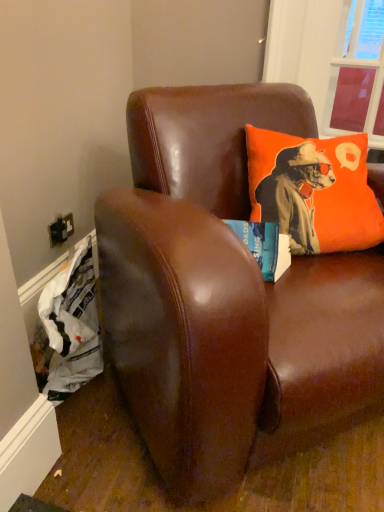
What do you see at coordinates (314, 191) in the screenshot? I see `orange fabric pillow at upper right` at bounding box center [314, 191].

Measure the distance between point (291, 233) and camera.

The depth of point (291, 233) is 3.80 feet.

The image size is (384, 512). I want to click on orange fabric pillow at upper right, so click(x=314, y=191).

Locate an element on the screen. pillow that is below the transparent plastic window screen at upper right (from the image's perspective) is located at coordinates (314, 191).

Considering the positions of points (362, 18) and (320, 149), is point (362, 18) farther from camera compared to point (320, 149)?

Yes.

Which object is more forward, transparent plastic window screen at upper right or orange fabric pillow at upper right?

orange fabric pillow at upper right is closer to the camera.

How far apart are transparent plastic window screen at upper right and orange fabric pillow at upper right?

transparent plastic window screen at upper right and orange fabric pillow at upper right are 1.41 meters apart from each other.

This screenshot has width=384, height=512. What are the coordinates of `studio couch below the orange fabric pillow at upper right (from the image's perspective)` in the screenshot? It's located at (226, 298).

Can you confirm if orange fabric pillow at upper right is thinner than brown leather couch at upper center?

Correct, the width of orange fabric pillow at upper right is less than that of brown leather couch at upper center.

At what (x,y) coordinates should I click in order to perform the action: click on pillow beneath the transparent plastic window screen at upper right (from a real-world perspective). Please return your answer as a coordinate pair (x, y). The width and height of the screenshot is (384, 512). Looking at the image, I should click on (314, 191).

From the picture: From the image's perspective, is orange fabric pillow at upper right beneath transparent plastic window screen at upper right?

Yes.

Which is less distant, (371, 191) or (352, 117)?

The point (371, 191) is closer to the camera.

Is orange fabric pillow at upper right next to transparent plastic window screen at upper right and touching it?

No, orange fabric pillow at upper right is not making contact with transparent plastic window screen at upper right.

Is brown leather couch at upper center oriented towards transparent plastic window screen at upper right?

No, brown leather couch at upper center is not facing towards transparent plastic window screen at upper right.

Who is shorter, brown leather couch at upper center or transparent plastic window screen at upper right?

Standing shorter between the two is transparent plastic window screen at upper right.

Can you confirm if brown leather couch at upper center is positioned to the right of transparent plastic window screen at upper right?

No, brown leather couch at upper center is not to the right of transparent plastic window screen at upper right.

Considering the points (219, 188) and (359, 85), which point is in front, point (219, 188) or point (359, 85)?

Point (219, 188)

From a real-world perspective, which object stands above the other?

transparent plastic window screen at upper right is physically above.

Looking at this image, how many degrees apart are the facing directions of transparent plastic window screen at upper right and brown leather couch at upper center?

There is a 44.5-degree angle between the facing directions of transparent plastic window screen at upper right and brown leather couch at upper center.

Can you confirm if transparent plastic window screen at upper right is thinner than brown leather couch at upper center?

Correct, the width of transparent plastic window screen at upper right is less than that of brown leather couch at upper center.

Which object is wider, brown leather couch at upper center or orange fabric pillow at upper right?

Wider between the two is brown leather couch at upper center.

Which is nearer, (307, 432) or (320, 209)?

Point (307, 432) is closer to the camera than point (320, 209).

Locate an element on the screen. The height and width of the screenshot is (512, 384). pillow above the brown leather couch at upper center (from a real-world perspective) is located at coordinates (314, 191).

From the picture: From the image's perspective, which object appears higher, brown leather couch at upper center or orange fabric pillow at upper right?

orange fabric pillow at upper right.

The image size is (384, 512). I want to click on pillow in front of the transparent plastic window screen at upper right, so click(314, 191).

Locate an element on the screen. This screenshot has height=512, width=384. pillow located on the right of brown leather couch at upper center is located at coordinates (314, 191).

Which object lies nearer to the anchor point orange fabric pillow at upper right, brown leather couch at upper center or transparent plastic window screen at upper right?

Based on the image, brown leather couch at upper center appears to be nearer to orange fabric pillow at upper right.

Which object lies further to the anchor point transparent plastic window screen at upper right, brown leather couch at upper center or orange fabric pillow at upper right?

brown leather couch at upper center lies further to transparent plastic window screen at upper right than the other object.

Considering their positions, is transparent plastic window screen at upper right positioned further to brown leather couch at upper center than orange fabric pillow at upper right?

Among the two, transparent plastic window screen at upper right is located further to brown leather couch at upper center.

Considering their positions, is orange fabric pillow at upper right positioned closer to transparent plastic window screen at upper right than brown leather couch at upper center?

orange fabric pillow at upper right.

When comparing their distances from brown leather couch at upper center, does orange fabric pillow at upper right or transparent plastic window screen at upper right seem further?

Based on the image, transparent plastic window screen at upper right appears to be further to brown leather couch at upper center.

Looking at this image, which object lies nearer to the anchor point orange fabric pillow at upper right, transparent plastic window screen at upper right or brown leather couch at upper center?

brown leather couch at upper center lies closer to orange fabric pillow at upper right than the other object.

This screenshot has width=384, height=512. I want to click on pillow between brown leather couch at upper center and transparent plastic window screen at upper right from front to back, so click(314, 191).